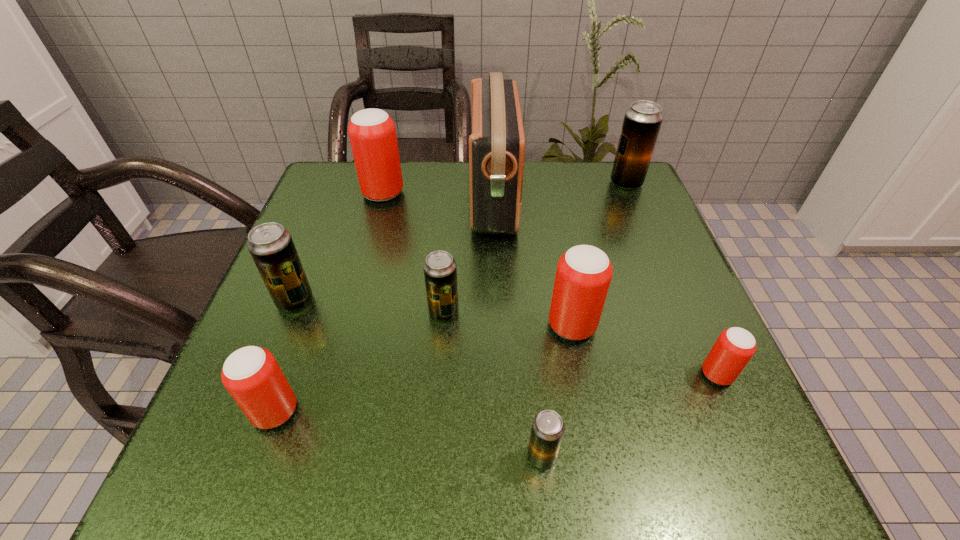
I want to click on free space at the far edge of the desktop, so click(395, 213).

I want to click on vacant position at the left edge of the desktop, so click(x=254, y=316).

Where is `vacant region at the right edge of the desktop`? vacant region at the right edge of the desktop is located at coordinates (676, 350).

Find the location of a particular element. The image size is (960, 540). vacant space at the far left corner of the desktop is located at coordinates (372, 215).

The width and height of the screenshot is (960, 540). In the image, there is a desktop. Identify the location of vacant space at the near left corner. (224, 449).

Find the location of `free space at the far right corner`. free space at the far right corner is located at coordinates (585, 201).

This screenshot has height=540, width=960. I want to click on free space that is in between the leftmost black beer can and the nearest red beer can, so click(x=285, y=356).

The height and width of the screenshot is (540, 960). Find the location of `free space between the leftmost black beer can and the rightmost black beer can`. free space between the leftmost black beer can and the rightmost black beer can is located at coordinates (461, 242).

This screenshot has height=540, width=960. In order to click on empty space between the fifth beer can from right to left and the smallest black beer can in this screenshot , I will do `click(492, 384)`.

Image resolution: width=960 pixels, height=540 pixels. Identify the location of vacant region between the radio receiver and the nearest object. click(517, 327).